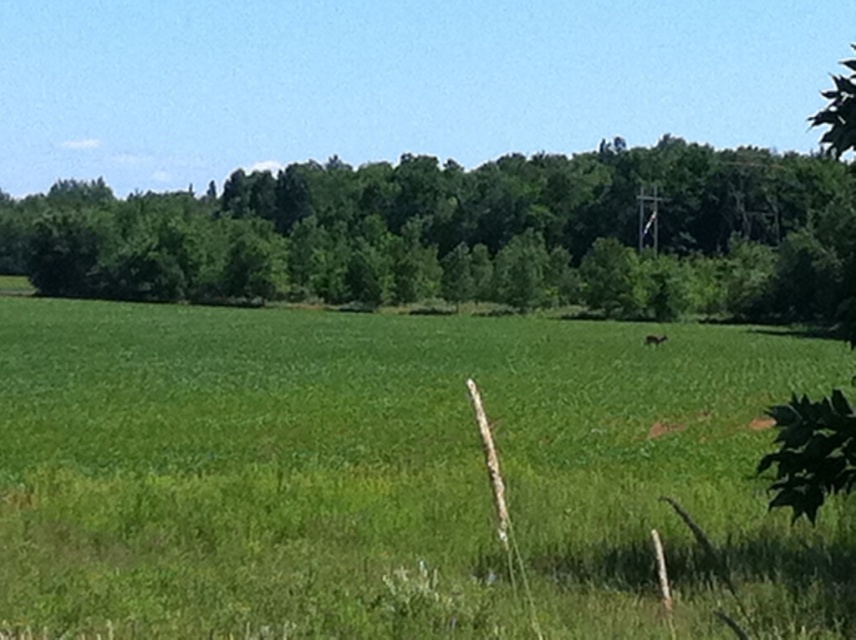
You are standing in the middle of the grassland and see two points marked in the image. Which point is closer to you, point (210,241) or point (651,340)?

Point (210,241) is closer to you because it is further to the viewer than point (651,340).

You are a hiker who wants to take a photo of the brown furry deer at center without the green leafy tree at center blocking the view. Is there a way to adjust your position to achieve this?

The green leafy tree at center is in front of the brown furry deer at center, so you would need to move to a position where the tree is no longer between you and the deer. This could involve moving to the side or behind the tree to get an unobstructed view of the deer.